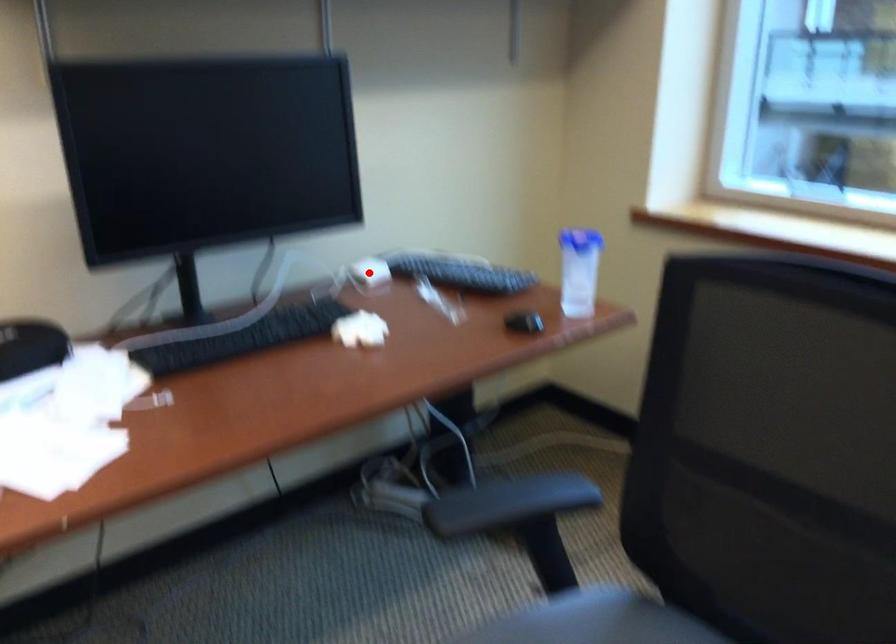
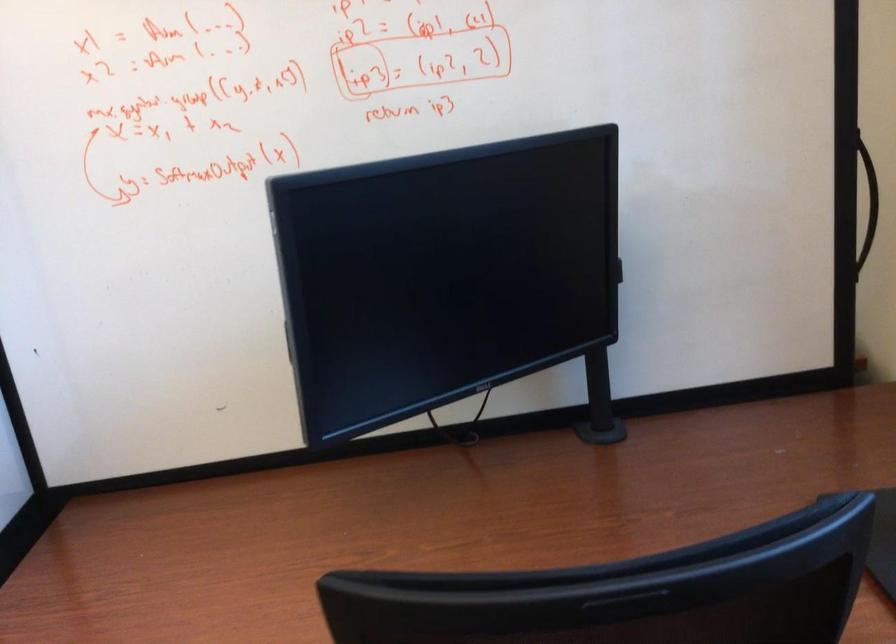
Question: I am providing you with two images of the same scene from different viewpoints. A red point is marked on the first image. Is the red point's position out of view in image 2?

Choices:
 (A) Yes
 (B) No

Answer: (A)